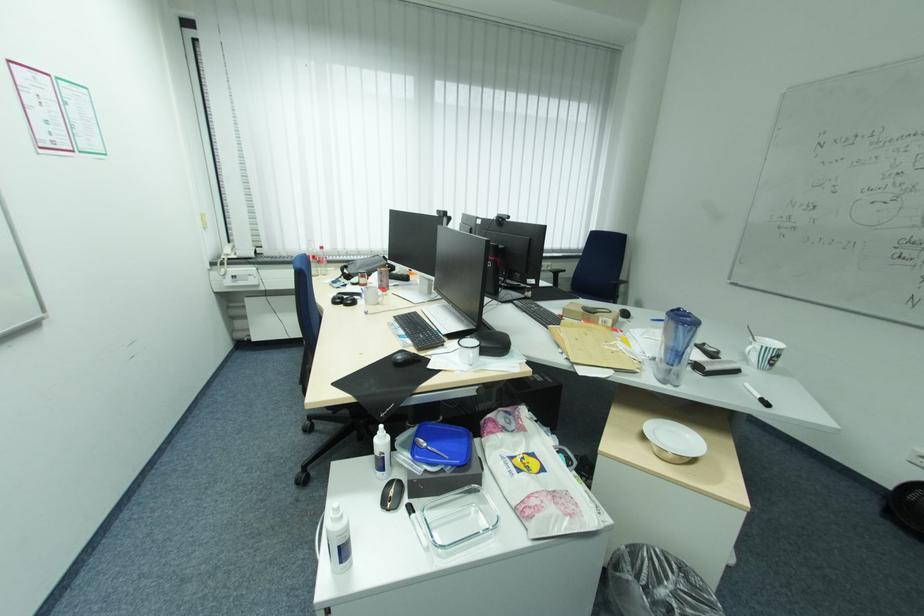
Where would you lift the telephone handset? Please return your answer as a coordinate pair (x, y).

(227, 251)